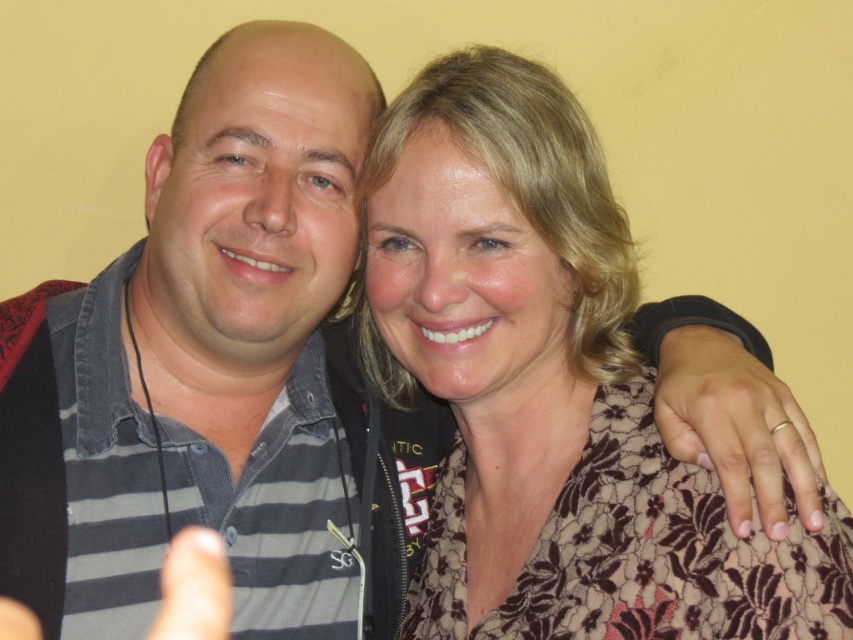
Question: Can you confirm if gold metallic ring at right is wider than matte black hand at lower left?

Choices:
 (A) yes
 (B) no

Answer: (B)

Question: Can you confirm if floral-patterned blouse at center is positioned below striped fabric shirt at left?

Choices:
 (A) yes
 (B) no

Answer: (A)

Question: Which object is closer to the camera taking this photo?

Choices:
 (A) striped fabric shirt at left
 (B) matte black thumb at lower left
 (C) gold metallic ring at right
 (D) floral-patterned blouse at center

Answer: (D)

Question: Which object is the closest to the floral-patterned blouse at center?

Choices:
 (A) striped fabric shirt at left
 (B) matte black hand at lower left
 (C) matte black thumb at lower left

Answer: (A)

Question: Considering the real-world distances, which object is farthest from the striped fabric shirt at left?

Choices:
 (A) matte black hand at lower left
 (B) floral-patterned blouse at center
 (C) gold metallic ring at right
 (D) matte black thumb at lower left

Answer: (C)

Question: In this image, where is floral-patterned blouse at center located relative to matte black thumb at lower left?

Choices:
 (A) below
 (B) above

Answer: (B)